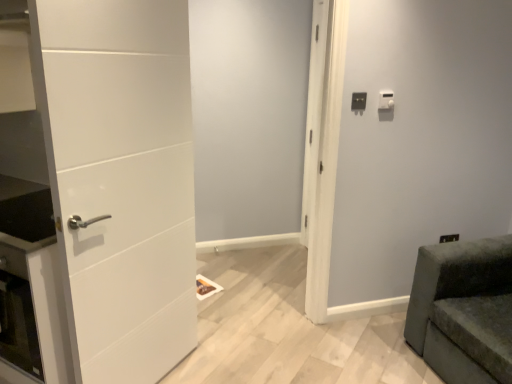
Locate an element on the screen. The width and height of the screenshot is (512, 384). vacant space in front of white matte door at center is located at coordinates [259, 359].